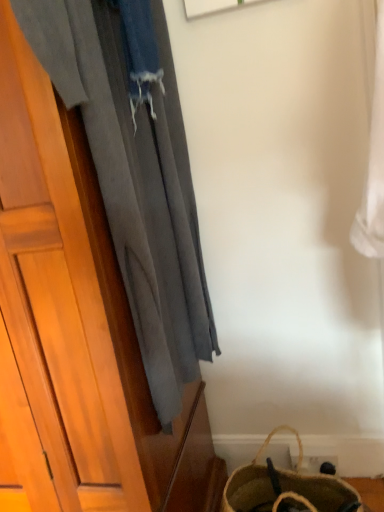
What do you see at coordinates (135, 184) in the screenshot? I see `gray fabric curtain at left` at bounding box center [135, 184].

This screenshot has height=512, width=384. Identify the location of gray fabric curtain at left. (135, 184).

What is the approximate height of brown woven bag at lower right?

The height of brown woven bag at lower right is 11.30 inches.

This screenshot has height=512, width=384. Find the location of `brown woven bag at lower right`. brown woven bag at lower right is located at coordinates (286, 487).

Describe the element at coordinates (286, 487) in the screenshot. I see `brown woven bag at lower right` at that location.

I want to click on gray fabric curtain at left, so click(x=135, y=184).

Considering the relative positions of gray fabric curtain at left and brown woven bag at lower right in the image provided, is gray fabric curtain at left to the left of brown woven bag at lower right from the viewer's perspective?

Yes, gray fabric curtain at left is to the left of brown woven bag at lower right.

Which object is closer to the camera, gray fabric curtain at left or brown woven bag at lower right?

gray fabric curtain at left is in front.

Considering the positions of point (175, 263) and point (237, 492), is point (175, 263) closer or farther from the camera than point (237, 492)?

Point (175, 263) is positioned closer to the camera compared to point (237, 492).

From the image's perspective, which object appears higher, gray fabric curtain at left or brown woven bag at lower right?

gray fabric curtain at left is shown above in the image.

From a real-world perspective, relative to brown woven bag at lower right, is gray fabric curtain at left vertically above or below?

In terms of real-world spatial position, gray fabric curtain at left is above brown woven bag at lower right.

Looking at their sizes, would you say gray fabric curtain at left is wider or thinner than brown woven bag at lower right?

gray fabric curtain at left is thinner than brown woven bag at lower right.

Considering the sizes of objects gray fabric curtain at left and brown woven bag at lower right in the image provided, who is shorter, gray fabric curtain at left or brown woven bag at lower right?

brown woven bag at lower right is shorter.

Can you confirm if gray fabric curtain at left is smaller than brown woven bag at lower right?

No.

Would you say gray fabric curtain at left is outside brown woven bag at lower right?

That's correct, gray fabric curtain at left is outside of brown woven bag at lower right.

Are gray fabric curtain at left and brown woven bag at lower right beside each other?

gray fabric curtain at left and brown woven bag at lower right are not in contact.

Could you tell me if gray fabric curtain at left is facing brown woven bag at lower right?

No.

What's the angular difference between gray fabric curtain at left and brown woven bag at lower right's facing directions?

The facing directions of gray fabric curtain at left and brown woven bag at lower right are 90.5 degrees apart.

Measure the distance from gray fabric curtain at left to brown woven bag at lower right.

gray fabric curtain at left is 23.27 inches away from brown woven bag at lower right.

Identify the location of handbag behind the gray fabric curtain at left. click(286, 487).

Considering the relative positions of brown woven bag at lower right and gray fabric curtain at left in the image provided, is brown woven bag at lower right to the left of gray fabric curtain at left from the viewer's perspective?

Incorrect, brown woven bag at lower right is not on the left side of gray fabric curtain at left.

Is brown woven bag at lower right further to camera compared to gray fabric curtain at left?

Yes, brown woven bag at lower right is further from the viewer.

Is point (328, 474) more distant than point (65, 80)?

Yes, it is.

In the scene shown: From the image's perspective, is brown woven bag at lower right beneath gray fabric curtain at left?

Correct, brown woven bag at lower right appears lower than gray fabric curtain at left in the image.

From a real-world perspective, is brown woven bag at lower right above or below gray fabric curtain at left?

Clearly, from a real-world perspective, brown woven bag at lower right is below gray fabric curtain at left.

Between brown woven bag at lower right and gray fabric curtain at left, which one has larger width?

brown woven bag at lower right is wider.

Considering the relative sizes of brown woven bag at lower right and gray fabric curtain at left in the image provided, is brown woven bag at lower right taller than gray fabric curtain at left?

In fact, brown woven bag at lower right may be shorter than gray fabric curtain at left.

Looking at the image, does brown woven bag at lower right seem bigger or smaller compared to gray fabric curtain at left?

Clearly, brown woven bag at lower right is smaller in size than gray fabric curtain at left.

Is gray fabric curtain at left surrounded by brown woven bag at lower right?

No, gray fabric curtain at left is not surrounded by brown woven bag at lower right.

Is brown woven bag at lower right not near gray fabric curtain at left?

No, brown woven bag at lower right is in close proximity to gray fabric curtain at left.

Is brown woven bag at lower right facing towards gray fabric curtain at left?

No, brown woven bag at lower right is not oriented towards gray fabric curtain at left.

Can you tell me how much brown woven bag at lower right and gray fabric curtain at left differ in facing direction?

The angle between the facing direction of brown woven bag at lower right and the facing direction of gray fabric curtain at left is 90.5 degrees.

Where is `handbag that appears below the gray fabric curtain at left (from the image's perspective)`? This screenshot has width=384, height=512. handbag that appears below the gray fabric curtain at left (from the image's perspective) is located at coordinates (286, 487).

This screenshot has width=384, height=512. Find the location of `curtain on the left of the brown woven bag at lower right`. curtain on the left of the brown woven bag at lower right is located at coordinates click(135, 184).

Where is `handbag behind the gray fabric curtain at left`? handbag behind the gray fabric curtain at left is located at coordinates tap(286, 487).